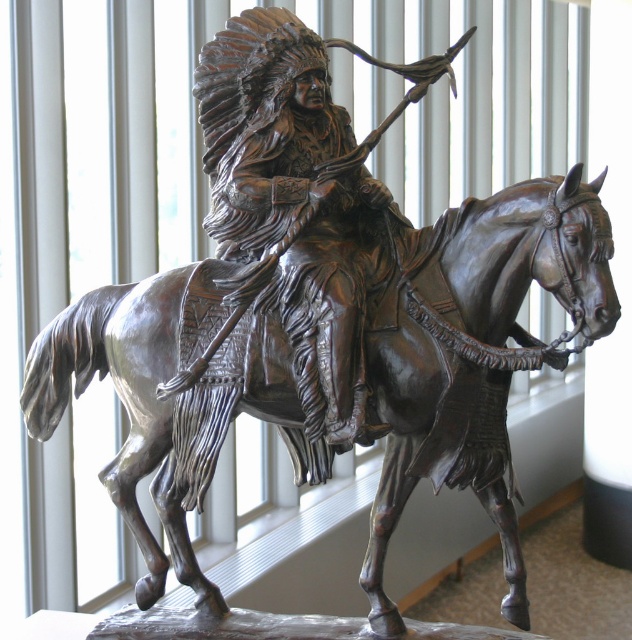
You are an art curator planning to display the bronze horse at center and bronze statue at center in a gallery. Given their sizes, which object should be placed on a higher pedestal to ensure both are visible to visitors standing at eye level?

The bronze horse at center is taller than the bronze statue at center. To ensure both are visible at eye level, the bronze statue at center should be placed on a higher pedestal so that its height matches the bronze horse at center when viewed from the visitors.

You are an art conservator assessing the spacing between two bronze sculptures in a gallery. The sculptures are the bronze horse at center and the bronze statue at center. The gallery has a narrow corridor that is 1.8 meters wide. Can both sculptures be placed side by side in the corridor without overlapping?

The bronze horse at center is wider than the bronze statue at center. Since the corridor is only 1.8 meters wide, we need to know the exact widths of both sculptures to determine if they can fit side by side. However, the information provided only states that the horse is wider than the statue, but not their specific measurements. Therefore, it is uncertain if they can fit without overlapping without additional data.

You are an art conservator examining the bronze sculpture. You notice that the bronze horse at center and bronze statue at center are positioned in a specific way. Which object is located lower in the artwork?

The bronze horse at center is positioned below the bronze statue at center, so it is located lower in the artwork.